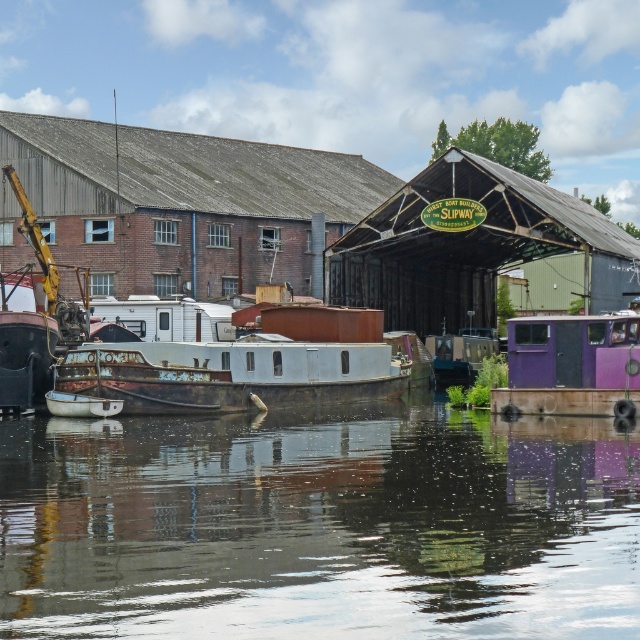
You are a photographer standing at the edge of the boatyard. You want to take a photo that includes both the rusty metal boat at center and the purple matte truck at lower right. Which object should you position closer to the front of your photo to ensure both are in focus?

To ensure both the rusty metal boat at center and the purple matte truck at lower right are in focus, position the rusty metal boat at center closer to the front of your photo since it is closer to you than the purple matte truck at lower right.